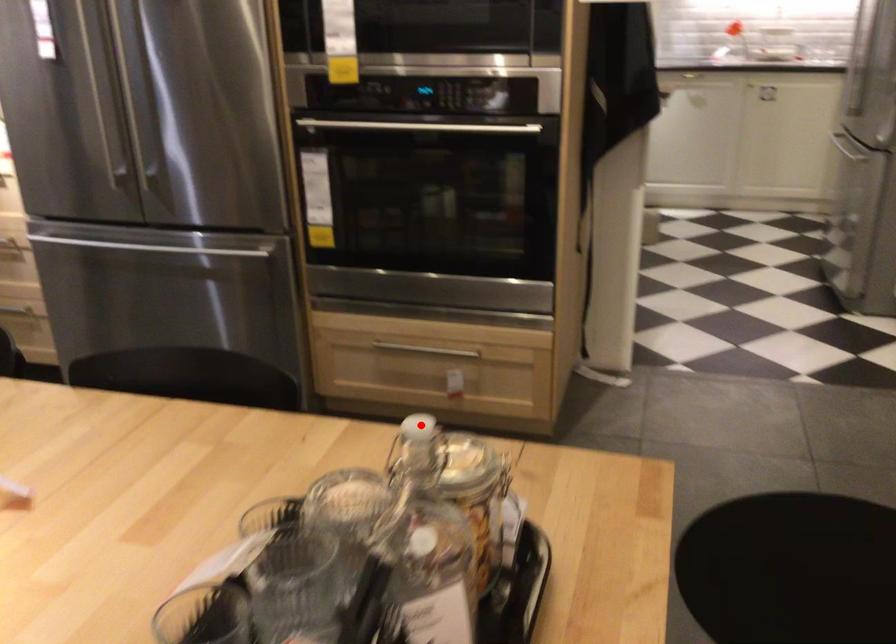
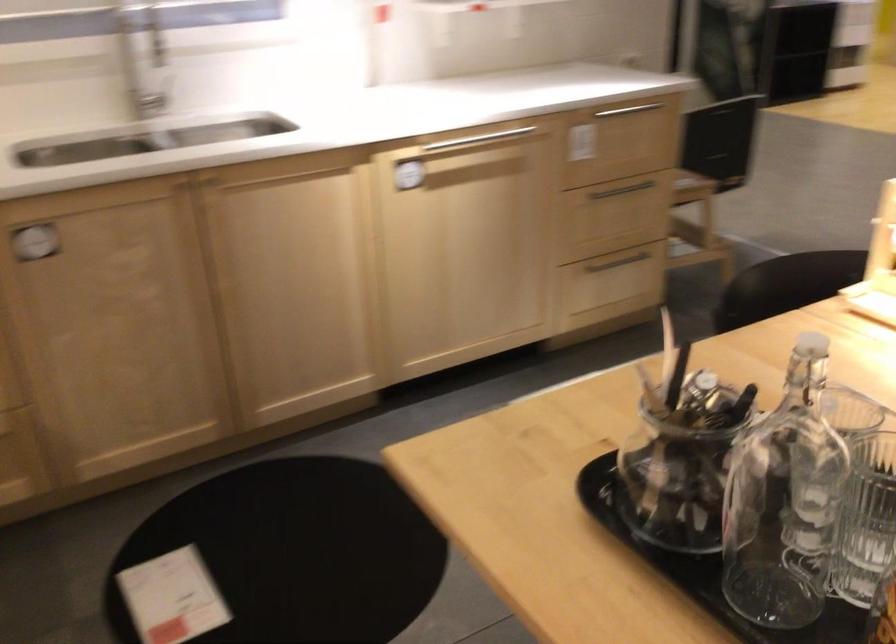
The point at the highlighted location is marked in the first image. Where is the corresponding point in the second image?

(814, 351)